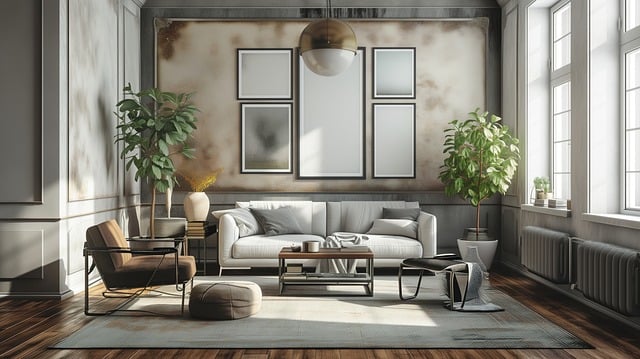
Where is `floor`? floor is located at coordinates pos(330,352).